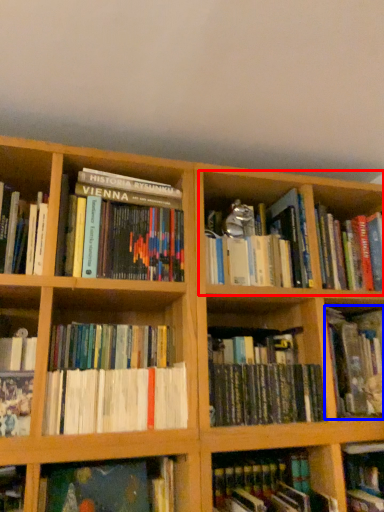
Question: Which object is further to the camera taking this photo, cabinet (highlighted by a red box) or book (highlighted by a blue box)?

Choices:
 (A) cabinet
 (B) book

Answer: (A)